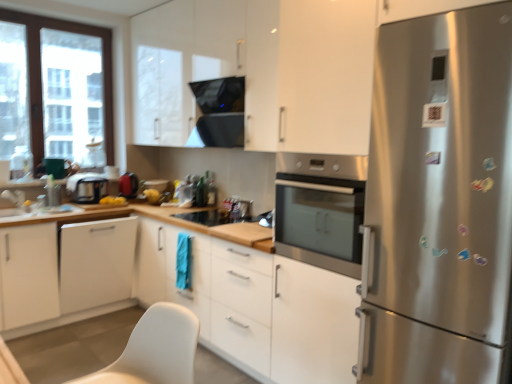
Question: In the image, is black glass exhaust hood at upper center positioned in front of or behind clear glass window at left?

Choices:
 (A) behind
 (B) front

Answer: (B)

Question: Is black glass exhaust hood at upper center spatially inside clear glass window at left, or outside of it?

Choices:
 (A) outside
 (B) inside

Answer: (A)

Question: Estimate the real-world distances between objects in this image. Which object is farther from the white glossy sink at lower left?

Choices:
 (A) stainless steel refrigerator at right
 (B) white matte cabinet at lower left, marked as the 2th cabinetry in a bottom-to-top arrangement
 (C) white matte cabinet at center, the first cabinetry ordered from the bottom
 (D) matte black kettle at left, the first appliance viewed from the right
 (E) white plastic table at lower left

Answer: (A)

Question: Based on their relative distances, which object is nearer to the matte black toaster at left, which is the second appliance from right to left?

Choices:
 (A) stainless steel refrigerator at right
 (B) clear glass window at left
 (C) white matte cabinet at lower left, acting as the third cabinetry starting from the top
 (D) black glass exhaust hood at upper center
 (E) white glossy cabinet at upper center, which ranks as the 1th cabinetry in top-to-bottom order

Answer: (C)